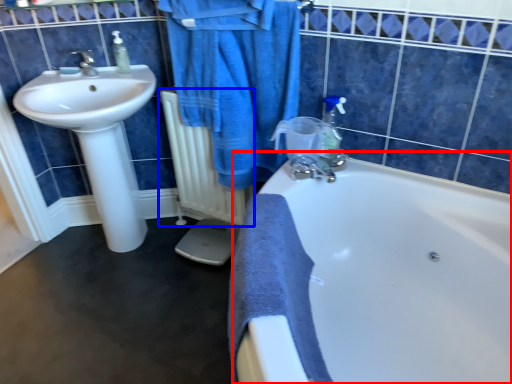
Question: Which object is further to the camera taking this photo, bathtub (highlighted by a red box) or radiator (highlighted by a blue box)?

Choices:
 (A) bathtub
 (B) radiator

Answer: (B)